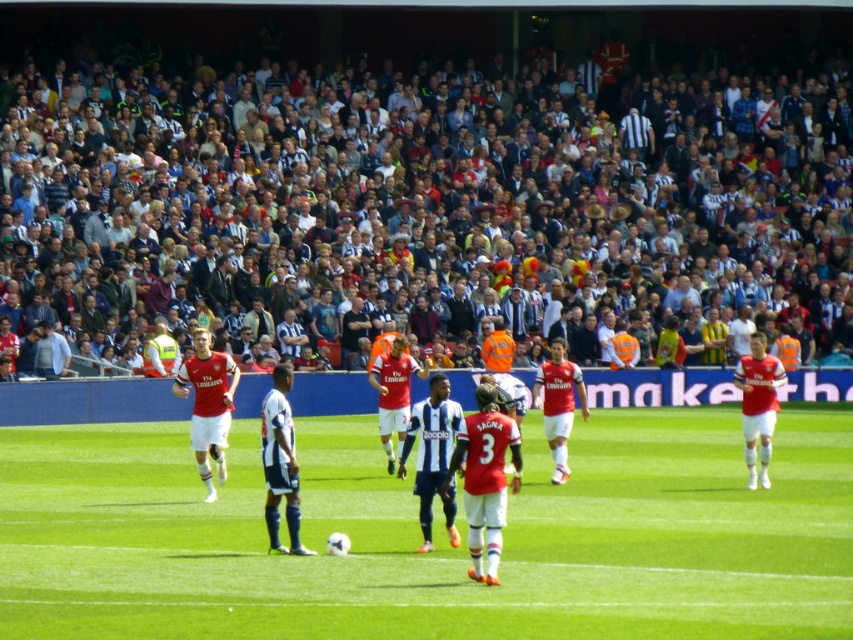
Question: Which is farther from the blue fabric crowd at upper center?

Choices:
 (A) red matte jersey at center
 (B) white striped jersey at center
 (C) white smooth soccer ball at center

Answer: (B)

Question: Does blue fabric crowd at upper center have a smaller size compared to red matte jersey at center?

Choices:
 (A) no
 (B) yes

Answer: (A)

Question: Considering the real-world distances, which object is closest to the white smooth soccer ball at center?

Choices:
 (A) blue fabric crowd at upper center
 (B) red matte jersey at center
 (C) white striped jersey at center

Answer: (B)

Question: Does red matte jersey at center come behind white striped jersey at center?

Choices:
 (A) yes
 (B) no

Answer: (B)

Question: Which of the following is the farthest from the observer?

Choices:
 (A) (714, 632)
 (B) (282, 378)
 (C) (496, 394)

Answer: (B)

Question: Is blue fabric crowd at upper center wider than white striped jersey at center?

Choices:
 (A) yes
 (B) no

Answer: (A)